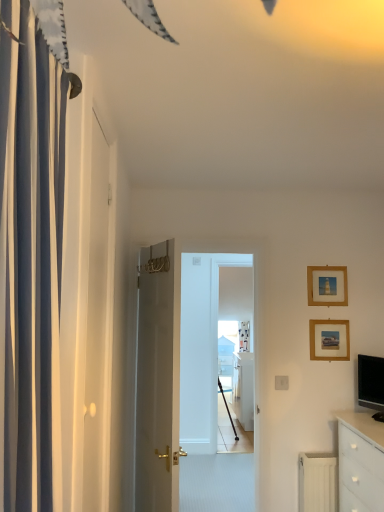
Question: Is white striped curtain at left to the left of matte black tv at right from the viewer's perspective?

Choices:
 (A) no
 (B) yes

Answer: (B)

Question: From a real-world perspective, does white striped curtain at left sit lower than matte black tv at right?

Choices:
 (A) yes
 (B) no

Answer: (B)

Question: Is matte black tv at right inside white striped curtain at left?

Choices:
 (A) yes
 (B) no

Answer: (B)

Question: Is matte black tv at right at the back of white striped curtain at left?

Choices:
 (A) no
 (B) yes

Answer: (A)

Question: Does white striped curtain at left have a greater height compared to matte black tv at right?

Choices:
 (A) no
 (B) yes

Answer: (B)

Question: Considering the relative sizes of white striped curtain at left and matte black tv at right in the image provided, is white striped curtain at left shorter than matte black tv at right?

Choices:
 (A) yes
 (B) no

Answer: (B)

Question: Considering the relative sizes of white striped curtain at left and white glossy chest of drawers at lower right in the image provided, is white striped curtain at left bigger than white glossy chest of drawers at lower right?

Choices:
 (A) no
 (B) yes

Answer: (A)

Question: From the image's perspective, does white striped curtain at left appear higher than white glossy chest of drawers at lower right?

Choices:
 (A) no
 (B) yes

Answer: (B)

Question: Is white striped curtain at left wider than white glossy chest of drawers at lower right?

Choices:
 (A) no
 (B) yes

Answer: (A)

Question: Is white striped curtain at left beside white glossy chest of drawers at lower right?

Choices:
 (A) no
 (B) yes

Answer: (A)

Question: From a real-world perspective, is white striped curtain at left beneath white glossy chest of drawers at lower right?

Choices:
 (A) no
 (B) yes

Answer: (A)

Question: From a real-world perspective, is white striped curtain at left on top of white glossy chest of drawers at lower right?

Choices:
 (A) no
 (B) yes

Answer: (B)

Question: Does white matte door at left have a lesser height compared to white glossy cabinet at center?

Choices:
 (A) yes
 (B) no

Answer: (B)